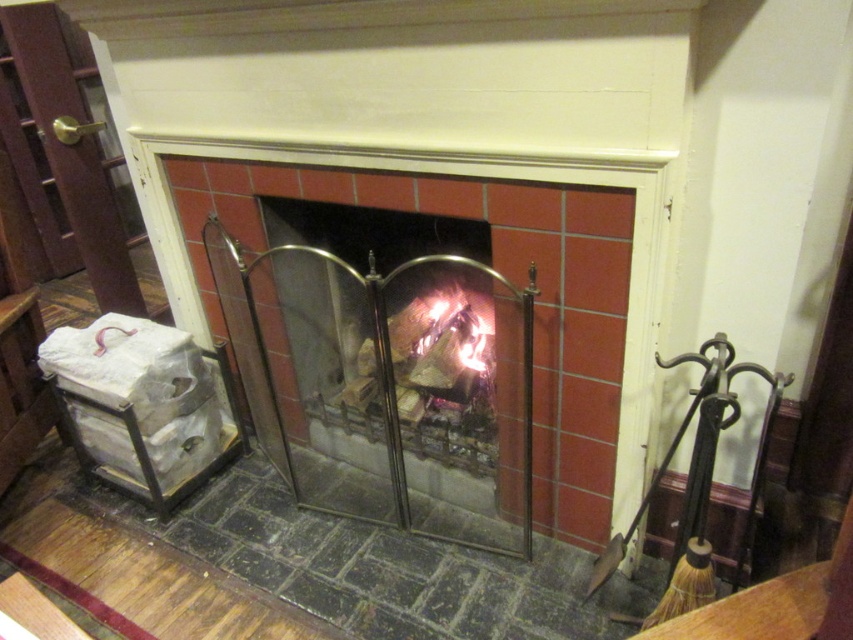
Question: Can you confirm if matte metal fireplace screen at center is wider than charcoal wood fire at center?

Choices:
 (A) yes
 (B) no

Answer: (A)

Question: Does matte metal fireplace screen at center have a smaller size compared to charcoal wood fire at center?

Choices:
 (A) no
 (B) yes

Answer: (A)

Question: Which point appears farthest from the camera in this image?

Choices:
 (A) pos(640,428)
 (B) pos(457,288)

Answer: (B)

Question: Which point appears closest to the camera in this image?

Choices:
 (A) (485, 308)
 (B) (169, 141)

Answer: (B)

Question: From the image, what is the correct spatial relationship of matte metal fireplace screen at center in relation to charcoal wood fire at center?

Choices:
 (A) left
 (B) right

Answer: (A)